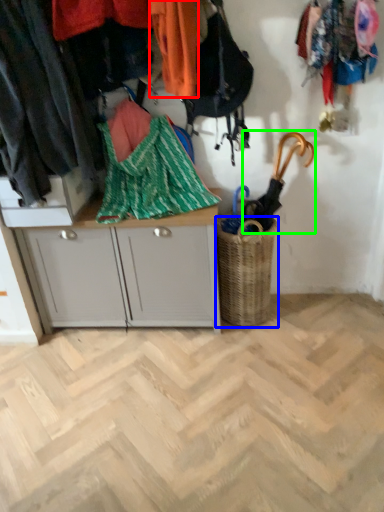
Question: Which object is positioned farthest from clothing (highlighted by a red box)? Select from basket (highlighted by a blue box) and umbrella (highlighted by a green box).

Choices:
 (A) basket
 (B) umbrella

Answer: (A)